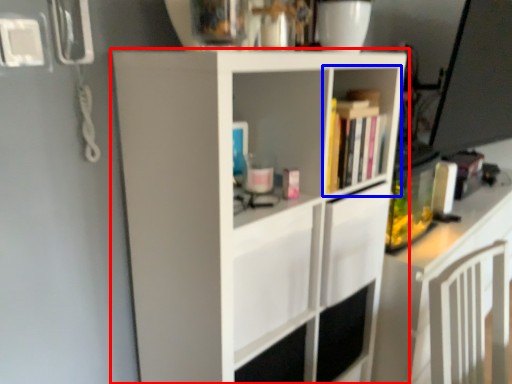
Question: Which of the following is the farthest to the observer, cupboard (highlighted by a red box) or shelf (highlighted by a blue box)?

Choices:
 (A) cupboard
 (B) shelf

Answer: (B)